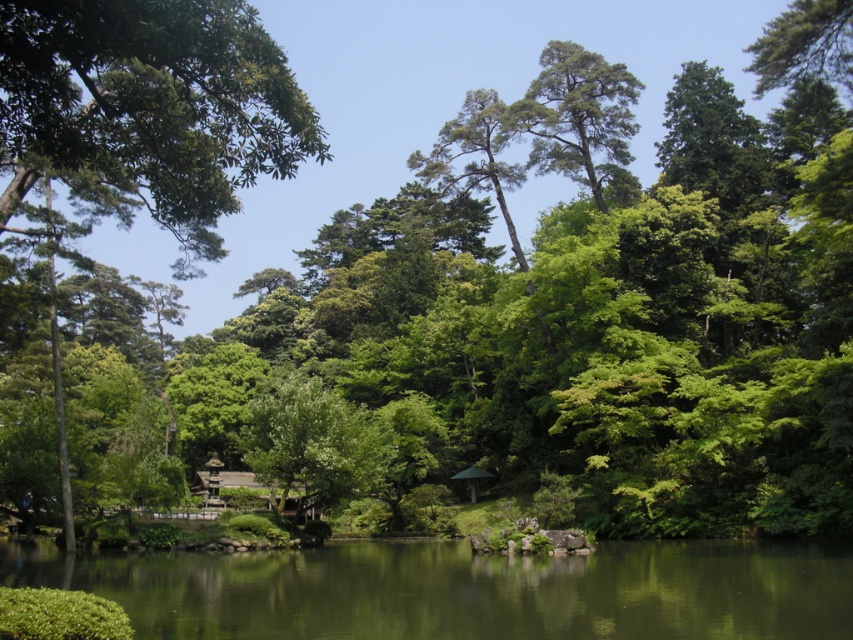
Is green leafy tree at upper left wider than green matte tree at upper center?

Correct, the width of green leafy tree at upper left exceeds that of green matte tree at upper center.

Measure the distance from green leafy tree at upper left to green matte tree at upper center.

green leafy tree at upper left and green matte tree at upper center are 30.22 meters apart.

Is point (10, 3) positioned before point (624, 108)?

That is True.

Locate an element on the screen. The image size is (853, 640). green leafy tree at upper left is located at coordinates (148, 109).

Between green smooth water at center and green leafy tree at upper left, which one is positioned lower?

green smooth water at center is below.

Is green smooth water at center further to camera compared to green leafy tree at upper left?

Yes, it is.

Find the location of a particular element. The image size is (853, 640). green smooth water at center is located at coordinates (463, 589).

Does green smooth water at center have a greater height compared to green matte tree at upper center?

Incorrect, green smooth water at center's height is not larger of green matte tree at upper center's.

Which of these two, green smooth water at center or green matte tree at upper center, stands taller?

green matte tree at upper center is taller.

Is point (253, 627) positioned behind point (630, 157)?

No, it is not.

Locate an element on the screen. Image resolution: width=853 pixels, height=640 pixels. green smooth water at center is located at coordinates (463, 589).